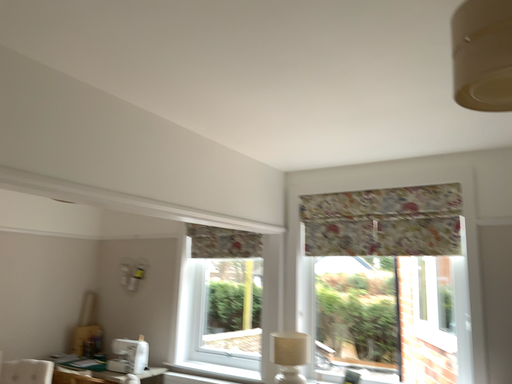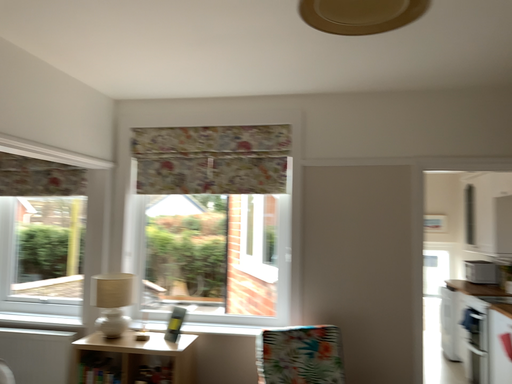
Question: Which way did the camera rotate in the video?

Choices:
 (A) rotated right
 (B) rotated left

Answer: (A)